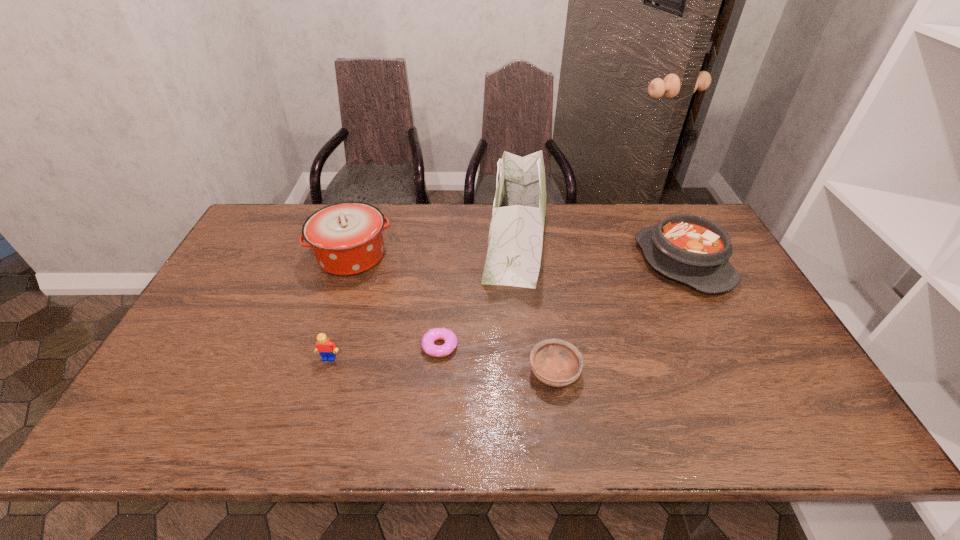
Locate an element on the screen. The width and height of the screenshot is (960, 540). empty location between the tallest object and the fourth tallest object is located at coordinates (422, 301).

At what (x,y) coordinates should I click in order to perform the action: click on object that is the fourth closest to the shorter casserole. Please return your answer as a coordinate pair (x, y). Looking at the image, I should click on (346, 238).

Select which object appears as the second closest to the bowl. Please provide its 2D coordinates. Your answer should be formatted as a tuple, i.e. [(x, y)], where the tuple contains the x and y coordinates of a point satisfying the conditions above.

[(515, 242)]

At what (x,y) coordinates should I click in order to perform the action: click on vacant point that satisfies the following two spatial constraints: 1. on the face of the bowl; 2. on the right side of the fourth tallest object. Please return your answer as a coordinate pair (x, y). Looking at the image, I should click on (325, 372).

Where is `free space that satisfies the following two spatial constraints: 1. on the face of the third shortest object; 2. on the right side of the bowl`? This screenshot has width=960, height=540. free space that satisfies the following two spatial constraints: 1. on the face of the third shortest object; 2. on the right side of the bowl is located at coordinates (325, 372).

You are a GUI agent. You are given a task and a screenshot of the screen. Output one action in this format:
    pyautogui.click(x=<x>, y=<y>)
    Task: Click on the vacant region that satisfies the following two spatial constraints: 1. on the front side of the tallest object; 2. on the left side of the shorter casserole
    
    Given the screenshot: What is the action you would take?
    pyautogui.click(x=517, y=262)

Where is `free spot that satisfies the following two spatial constraints: 1. on the front side of the tallest object; 2. on the right side of the bowl`? free spot that satisfies the following two spatial constraints: 1. on the front side of the tallest object; 2. on the right side of the bowl is located at coordinates (527, 372).

You are a GUI agent. You are given a task and a screenshot of the screen. Output one action in this format:
    pyautogui.click(x=<x>, y=<y>)
    Task: Click on the free region that satisfies the following two spatial constraints: 1. on the front side of the fifth shortest object; 2. on the right side of the shorter casserole
    The width and height of the screenshot is (960, 540).
    Given the screenshot: What is the action you would take?
    pyautogui.click(x=349, y=262)